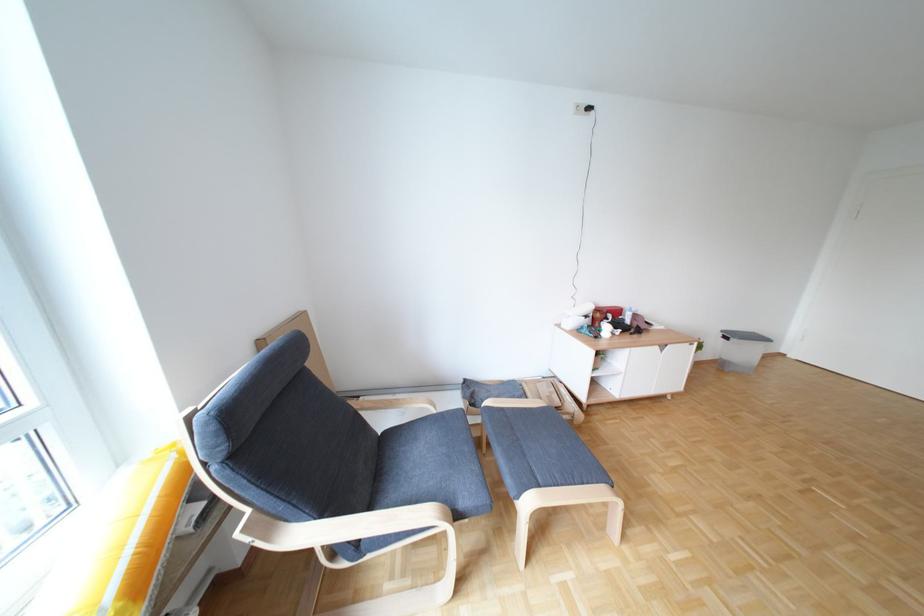
You are a GUI agent. You are given a task and a screenshot of the screen. Output one action in this format:
    pyautogui.click(x=<x>, y=<y>)
    Task: Click on the long yellow cushion
    
    Given the screenshot: What is the action you would take?
    pyautogui.click(x=119, y=541)